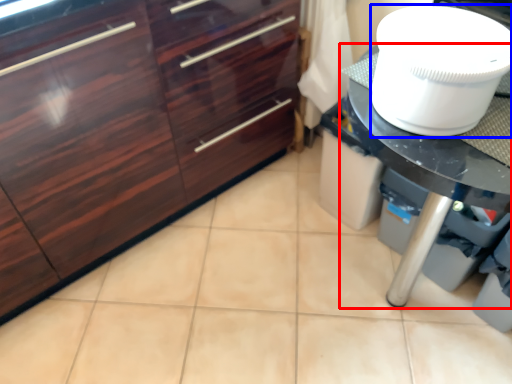
Question: Which of the following is the closest to the observer, countertop (highlighted by a red box) or toilet bowl (highlighted by a blue box)?

Choices:
 (A) countertop
 (B) toilet bowl

Answer: (B)